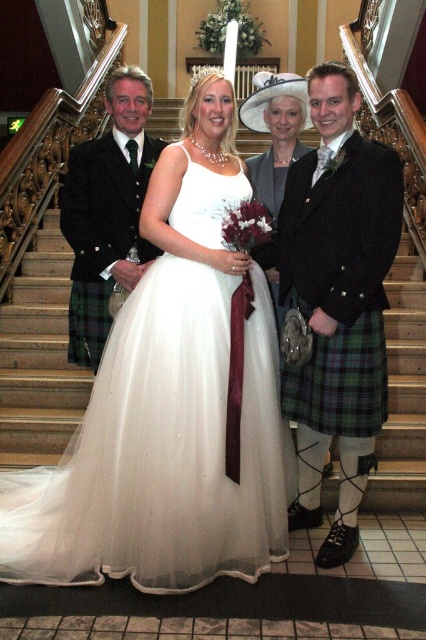
You are standing at the entrance of the venue and want to approach the bride wearing the white tulle dress at center. According to the coordinates provided, in which direction should you move to reach her?

The white tulle dress at center is located at coordinates point (x=161, y=449), so you should move towards the center of the venue to reach the bride wearing the white tulle dress at center.

You are a photographer at the wedding and need to adjust the camera focus so that both the white tulle dress at center and the green plaid kilt at right are in focus. Based on their positions, which one should you focus on first to ensure depth of field?

The white tulle dress at center is not as tall as the green plaid kilt at right, so focusing on the green plaid kilt at right first would help ensure both are in focus due to its greater height.

In the wedding scene, you notice the white tulle dress at center and the green plaid kilt at right. Which one appears bigger in size?

The white tulle dress at center has a larger size compared to the green plaid kilt at right, so the white tulle dress at center appears bigger.